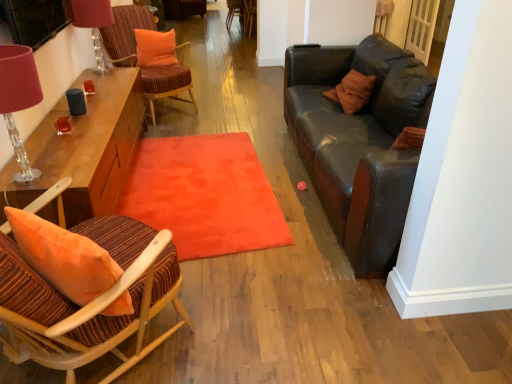
Question: Is point (176, 61) closer or farther from the camera than point (256, 16)?

Choices:
 (A) farther
 (B) closer

Answer: (B)

Question: From a real-world perspective, is orange fabric pillow at upper center above or below wooden armchair at center, positioned as the first armchair in right-to-left order?

Choices:
 (A) below
 (B) above

Answer: (B)

Question: Which is farther from the velvet orange chair at upper left, the second chair viewed from the top?

Choices:
 (A) matte pink lampshade at upper left, the first table lamp from the back
 (B) velvet orange rug at center
 (C) striped fabric chair at left, the 3th chair when ordered from back to front
 (D) wooden armchair at center, acting as the second armchair starting from the right
 (E) wooden chair at center, the 1th chair positioned from the back

Answer: (D)

Question: Based on their relative distances, which object is farther from the striped fabric chair at left, which ranks as the 1th chair in bottom-to-top order?

Choices:
 (A) matte pink lampshade at upper left, the second table lamp from the front
 (B) wooden chair at center, placed as the 3th chair when sorted from front to back
 (C) wooden armchair at center, positioned as the first armchair in right-to-left order
 (D) orange fabric pillow at upper center
 (E) wooden armchair at center, arranged as the first armchair when viewed from the left

Answer: (E)